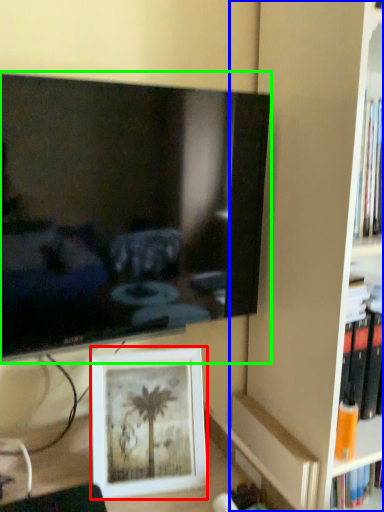
Question: Estimate the real-world distances between objects in this image. Which object is closer to picture frame (highlighted by a red box), bookshelf (highlighted by a blue box) or television (highlighted by a green box)?

Choices:
 (A) bookshelf
 (B) television

Answer: (B)